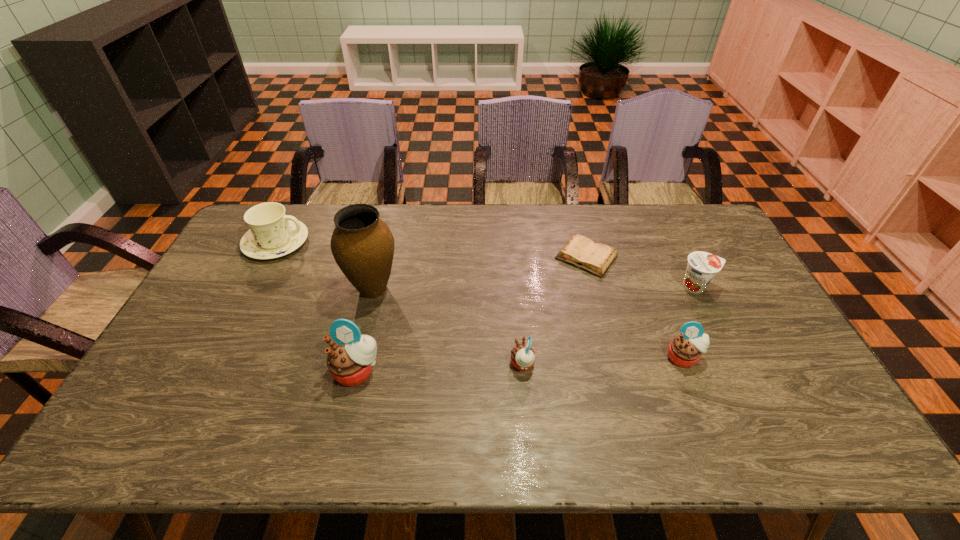
The muffins are evenly distributed in the image. To maintain this, where would you place another muffin on the left? Please point to a free space. Please provide its 2D coordinates. Your answer should be formatted as a tuple, i.e. [(x, y)], where the tuple contains the x and y coordinates of a point satisfying the conditions above.

[(187, 378)]